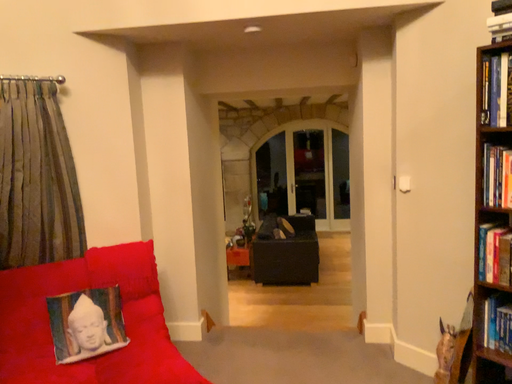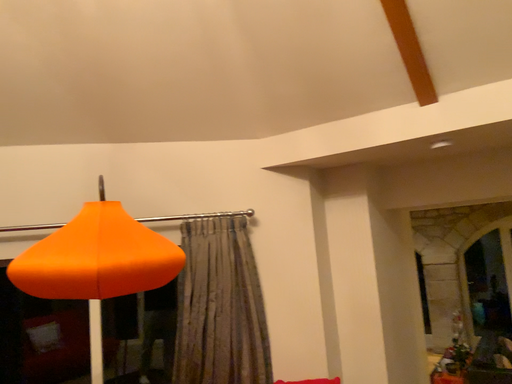
Question: Which way did the camera rotate in the video?

Choices:
 (A) rotated left
 (B) rotated right

Answer: (A)